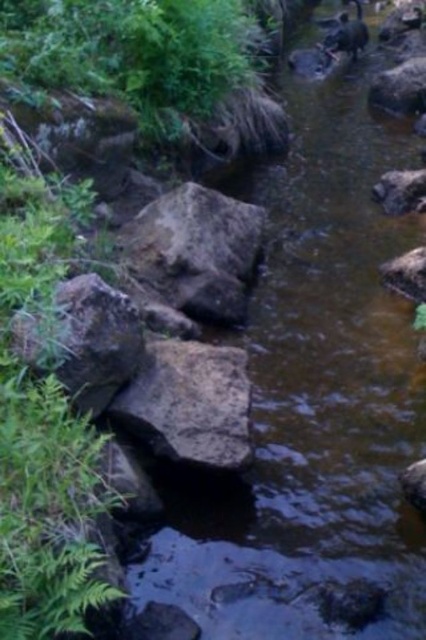
You are standing at the edge of the stream and see two points in the water. One is at point (149, 268) and the other is at point (23, 348). Which point is closer to you?

Point (149, 268) is further to the camera than point (23, 348), so the point closer to you is point (23, 348).

You are a hiker with a 3.05 meter long rope. You need to cross the stream using the rough stone boulder at center as an anchor point. Is your rope long enough to reach from the left bank to the right bank?

The distance between the left bank and the right bank is 12.19 feet, which is approximately 3.72 meters. Since your rope is 3.05 meters long, it is not long enough to span the distance from the left bank to the right bank using the rough stone boulder at center as an anchor point.

You are a hiker trying to cross the stream. You see a rough stone boulder at center and a brown rough rock at center. Which one is closer to you?

The rough stone boulder at center is closer to you because the brown rough rock at center is behind it.